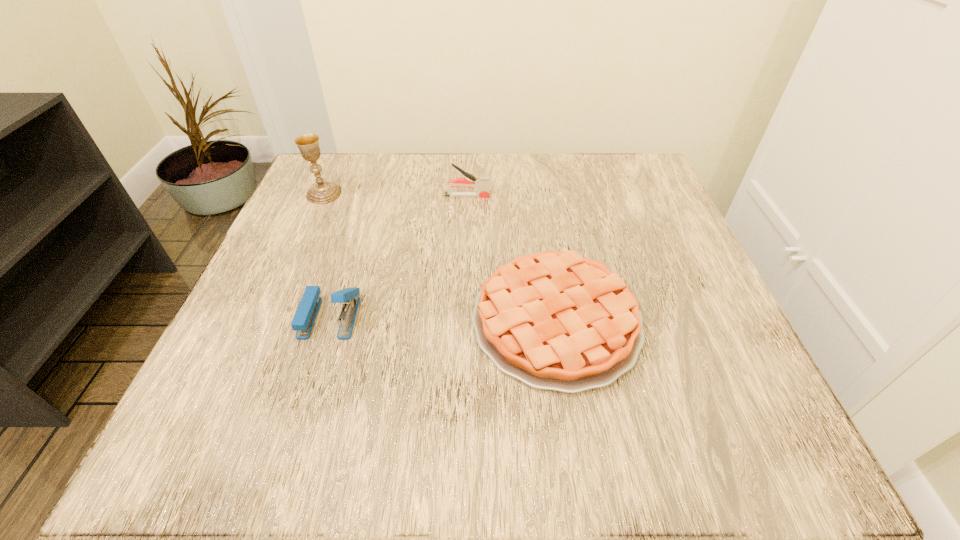
Find the location of `chalice positioned at the far edge`. chalice positioned at the far edge is located at coordinates (323, 192).

This screenshot has width=960, height=540. Identify the location of stapler located in the far edge section of the desktop. (481, 183).

The image size is (960, 540). Find the location of `chalice situated at the left edge`. chalice situated at the left edge is located at coordinates (323, 192).

The image size is (960, 540). I want to click on stapler that is positioned at the left edge, so click(x=304, y=318).

Image resolution: width=960 pixels, height=540 pixels. What are the coordinates of `object that is at the right edge` in the screenshot? It's located at tap(554, 320).

You are a GUI agent. You are given a task and a screenshot of the screen. Output one action in this format:
    pyautogui.click(x=<x>, y=<y>)
    Task: Click on the object situated at the far left corner
    This screenshot has height=540, width=960.
    Given the screenshot: What is the action you would take?
    pyautogui.click(x=323, y=192)

I want to click on vacant space at the far edge, so click(x=534, y=212).

At what (x,y) coordinates should I click in order to perform the action: click on free space at the near edge. Please return your answer as a coordinate pair (x, y). The image size is (960, 540). Looking at the image, I should click on (404, 440).

At what (x,y) coordinates should I click in order to perform the action: click on vacant region at the left edge of the desktop. Please return your answer as a coordinate pair (x, y). This screenshot has width=960, height=540. Looking at the image, I should click on (362, 221).

What are the coordinates of `vacant area at the right edge of the desktop` in the screenshot? It's located at (687, 305).